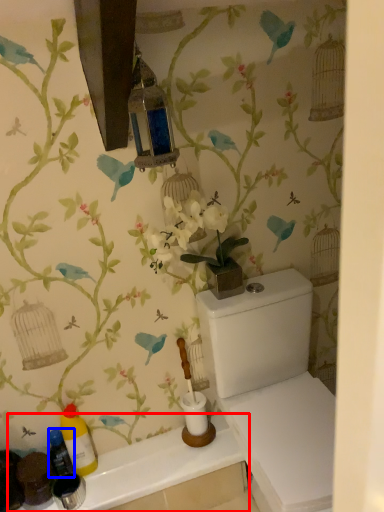
Question: Which point is closer to the camera, counter top (highlighted by a red box) or bottle (highlighted by a blue box)?

Choices:
 (A) counter top
 (B) bottle

Answer: (A)